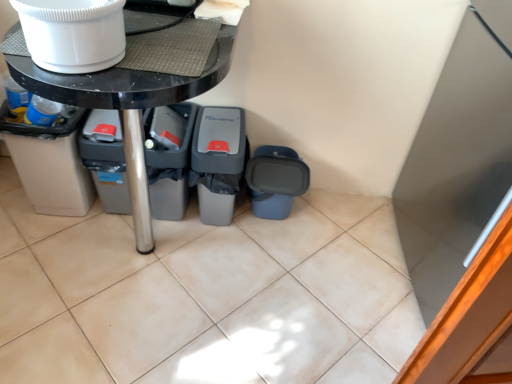
Image resolution: width=512 pixels, height=384 pixels. Identify the location of free spot above blue matte recycling bin at lower right, which appears as the 1th recycling bin when viewed from the right (from a real-world perspective). (280, 173).